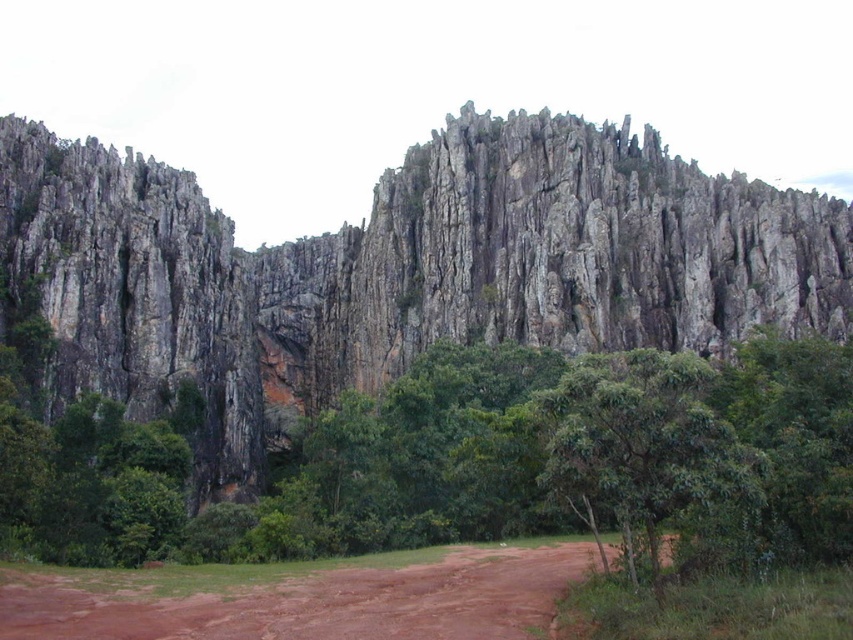
You are hiking in this landscape and want to take a photo of both the green leafy tree at center and the green leafy tree at lower right. Which tree should you position yourself to the left of to capture both in the frame?

To capture both the green leafy tree at center and the green leafy tree at lower right in the frame, you should position yourself to the left of the green leafy tree at lower right. This is because the green leafy tree at center is already to the left of the green leafy tree at lower right, so positioning yourself to the left of the latter would allow both trees to be included in the photo.

You are a hiker planning to set up a tent in the brown dirt field at lower center. However, you notice the green leafy tree at lower right nearby. Based on their positions, is there a risk that the tree might block sunlight from reaching your tent during the day?

The brown dirt field at lower center is positioned under the green leafy tree at lower right, so the tree is directly above the field. This means the tree will likely cast a shadow over the brown dirt field at lower center, blocking sunlight from reaching your tent during part of the day.

You are a hiker trying to reach the green leafy tree at lower right from your current position on the brown dirt field at lower center. Which direction should you move to get there?

The green leafy tree at lower right is on the right side of the brown dirt field at lower center, so you should move to the right to reach it.